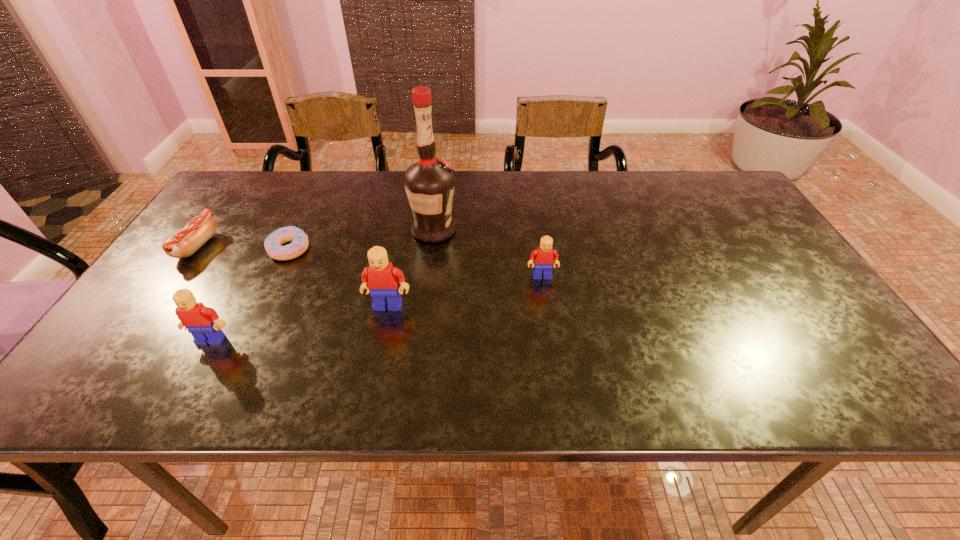
Find the location of a particular element. This screenshot has width=960, height=540. blank space located on the face of the fifth farthest object is located at coordinates (379, 351).

Image resolution: width=960 pixels, height=540 pixels. Find the location of `vacant area situated on the face of the rightmost object`. vacant area situated on the face of the rightmost object is located at coordinates (554, 356).

You are a GUI agent. You are given a task and a screenshot of the screen. Output one action in this format:
    pyautogui.click(x=<x>, y=<y>)
    Task: Click on the vacant space located 0.340m on the front and back of the liquor
    The height and width of the screenshot is (540, 960).
    Given the screenshot: What is the action you would take?
    pyautogui.click(x=578, y=231)

Find the location of a particular element. vacant space located 0.120m on the left of the shortest object is located at coordinates (224, 249).

In order to click on free space located 0.100m on the right of the leftmost object in this screenshot , I will do `click(251, 246)`.

You are a GUI agent. You are given a task and a screenshot of the screen. Output one action in this format:
    pyautogui.click(x=<x>, y=<y>)
    Task: Click on the object that is at the near edge
    
    Given the screenshot: What is the action you would take?
    pyautogui.click(x=203, y=323)

Identify the location of object located at the left edge. (198, 231).

In the image, there is a desktop. Where is `vacant space at the far edge`? This screenshot has width=960, height=540. vacant space at the far edge is located at coordinates (507, 174).

Locate an element on the screen. Image resolution: width=960 pixels, height=540 pixels. free location at the near edge of the desktop is located at coordinates coord(585,359).

The height and width of the screenshot is (540, 960). In order to click on vacant space at the left edge of the desktop in this screenshot , I will do `click(166, 272)`.